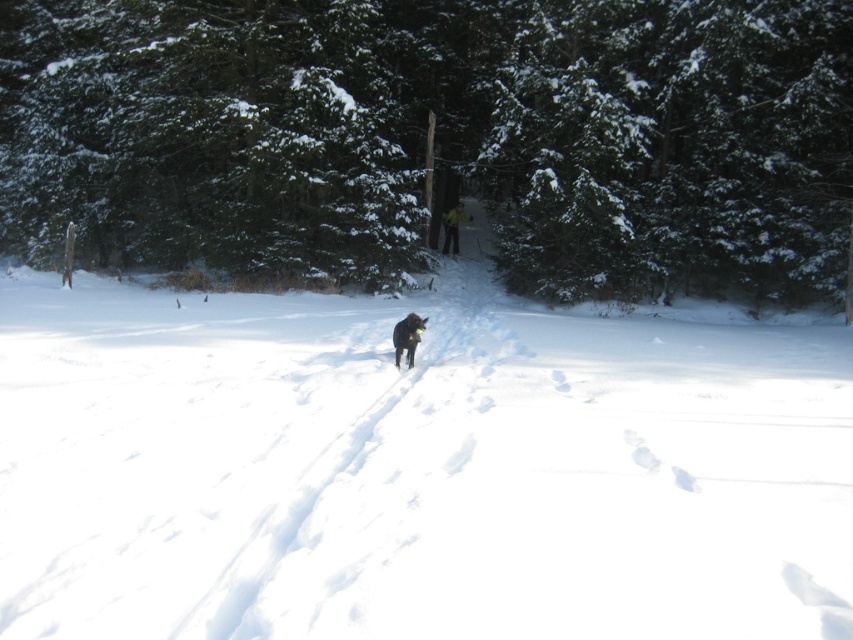
Which is more to the left, white fluffy snow at center or black fur dog at center?

Positioned to the left is black fur dog at center.

Between point (833, 342) and point (405, 317), which one is positioned behind?

The point (833, 342) is more distant.

Is point (604, 458) positioned before point (393, 326)?

That is True.

Where is `white fluffy snow at center`? white fluffy snow at center is located at coordinates (416, 467).

Between point (173, 4) and point (413, 333), which one is positioned behind?

The point (173, 4) is behind.

Is snow-covered evergreen tree at center in front of black fur dog at center?

No, it is not.

Identify the location of snow-covered evergreen tree at center. (438, 138).

Is white fluffy snow at center below yellow fabric skier at center?

Indeed, white fluffy snow at center is positioned under yellow fabric skier at center.

Can you confirm if white fluffy snow at center is shorter than yellow fabric skier at center?

Incorrect, white fluffy snow at center's height does not fall short of yellow fabric skier at center's.

What do you see at coordinates (416, 467) in the screenshot? This screenshot has width=853, height=640. I see `white fluffy snow at center` at bounding box center [416, 467].

Where is `white fluffy snow at center`? This screenshot has width=853, height=640. white fluffy snow at center is located at coordinates (416, 467).